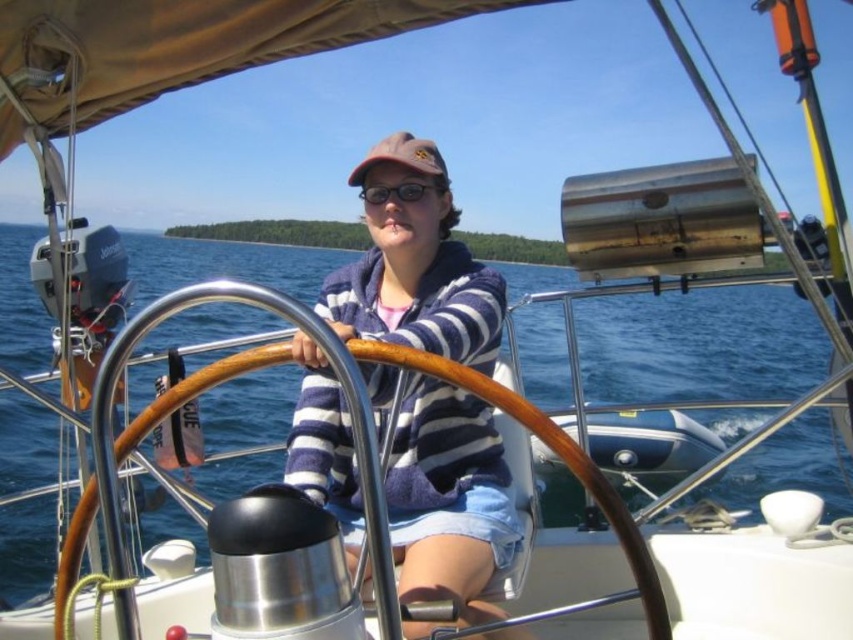
Find the location of a particular element. This screenshot has height=640, width=853. wooden at center is located at coordinates (532, 433).

Find the location of a particular element. Image resolution: width=853 pixels, height=640 pixels. wooden at center is located at coordinates (532, 433).

Does striped cotton sweater at center appear on the right side of wooden at center?

In fact, striped cotton sweater at center is to the left of wooden at center.

What do you see at coordinates (415, 268) in the screenshot? I see `striped cotton sweater at center` at bounding box center [415, 268].

At what (x,y) coordinates should I click in order to perform the action: click on striped cotton sweater at center. Please return your answer as a coordinate pair (x, y). Looking at the image, I should click on (415, 268).

Identify the location of striped cotton sweater at center. (415, 268).

Which is behind, point (405, 438) or point (410, 193)?

The point (410, 193) is more distant.

Is striped cotton sweater at center shorter than transparent plastic goggles at center?

No.

At what (x,y) coordinates should I click in order to perform the action: click on striped cotton sweater at center. Please return your answer as a coordinate pair (x, y). The width and height of the screenshot is (853, 640). Looking at the image, I should click on (415, 268).